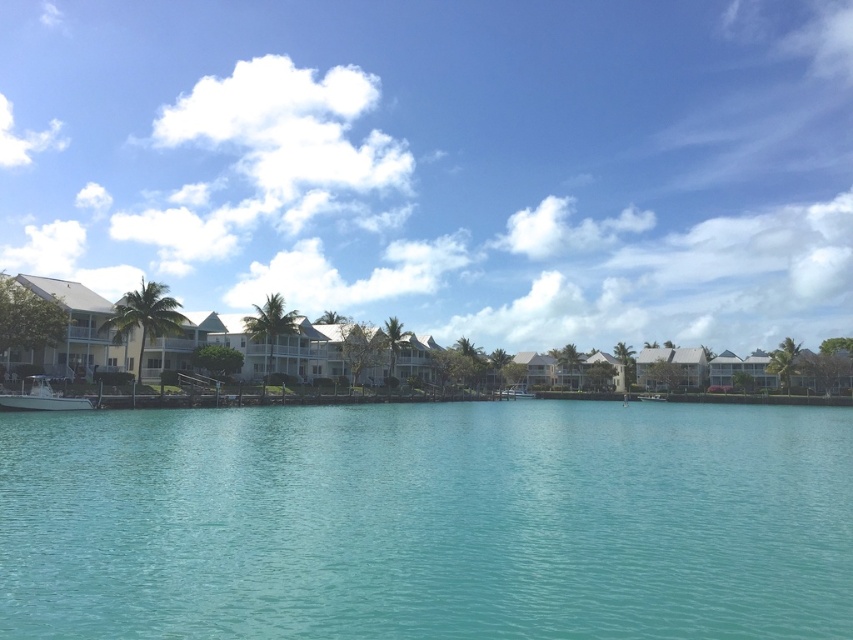
You are a boat operator who needs to navigate a 25 meter long vessel through the water. You see the clear blue water at center and the white fiberglass boat at lower left. Is there enough space between them for your vessel to pass safely?

The distance between the clear blue water at center and the white fiberglass boat at lower left is 27.39 meters. Since your vessel is 25 meters long, there is sufficient space for it to pass safely through the clear blue water at center near the white fiberglass boat at lower left.

You are standing at the center of the dock on the left side of the waterfront scene. You notice a point marked at coordinates point (44, 397). Based on the scene description, can you determine what object this point is located on?

The point (44, 397) is located on the white fiberglass boat at lower left.

You are a tour guide leading a group of visitors on a boat tour. You want to ensure that the boat can safely navigate between the clear blue water at center and the white glossy boat at center. Given that the boat requires a minimum of 80 meters of space to maneuver safely, can the boat safely navigate between these two points?

The clear blue water at center and the white glossy boat at center are 78.81 meters apart from each other. Since the required minimum space for safe navigation is 80 meters, the boat cannot safely navigate between these two points due to insufficient space.